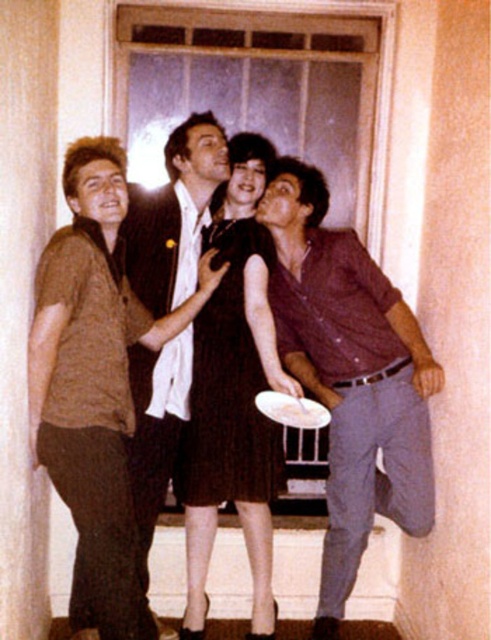
Who is positioned more to the right, purple cotton vest at right or matte black dress at center?

purple cotton vest at right is more to the right.

Does purple cotton vest at right have a lesser width compared to matte black dress at center?

Incorrect, purple cotton vest at right's width is not less than matte black dress at center's.

Which is behind, point (294, 259) or point (200, 268)?

Point (294, 259)

At what (x,y) coordinates should I click in order to perform the action: click on purple cotton vest at right. Please return your answer as a coordinate pair (x, y). The height and width of the screenshot is (640, 491). Looking at the image, I should click on (351, 376).

Is matte black dress at center positioned before white glossy platter at center?

Yes, matte black dress at center is closer to the viewer.

I want to click on matte black dress at center, so click(94, 387).

Identify the location of matte black dress at center. This screenshot has width=491, height=640. (94, 387).

In the scene shown: Is dark brown dress at center in front of white glossy platter at center?

No.

Between dark brown dress at center and white glossy platter at center, which one is positioned lower?

white glossy platter at center is lower down.

Describe the element at coordinates (235, 397) in the screenshot. I see `dark brown dress at center` at that location.

What are the coordinates of `dark brown dress at center` in the screenshot? It's located at (235, 397).